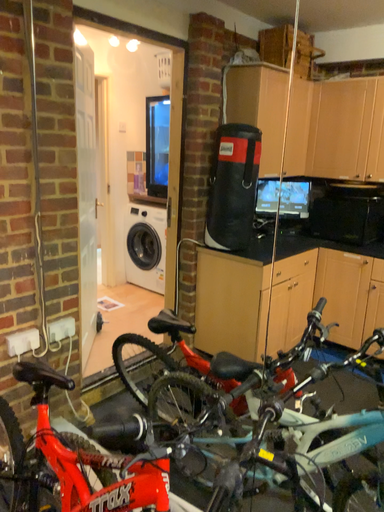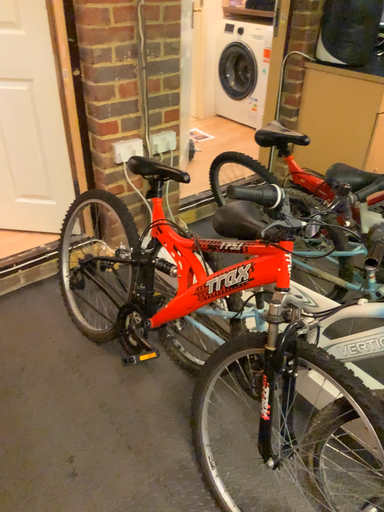
Question: How did the camera likely rotate when shooting the video?

Choices:
 (A) rotated left
 (B) rotated right

Answer: (A)